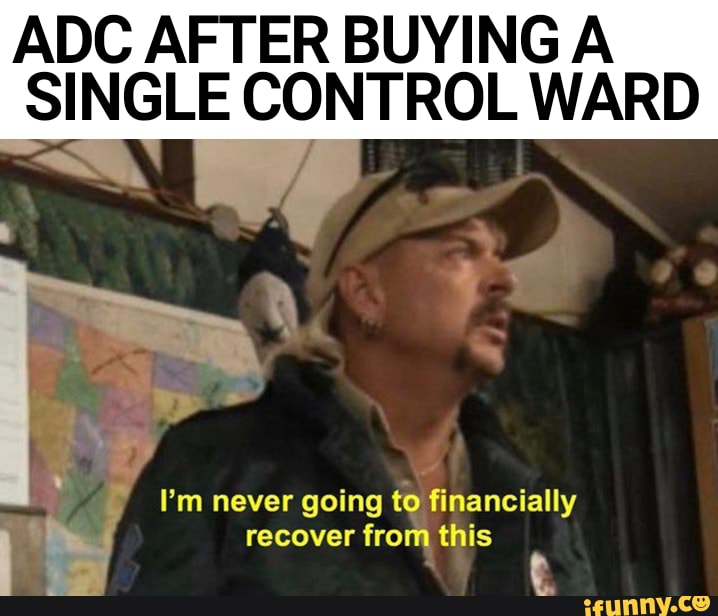
I want to click on ceiling, so click(x=665, y=164).